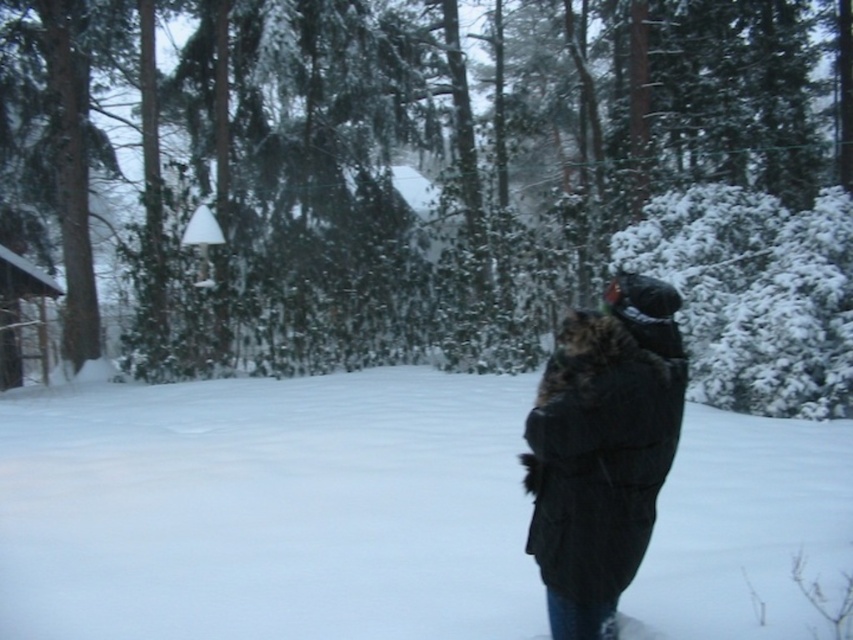
You are standing in the winter scene and want to take a photo of the dark fur coat at center and the wooden cabin at left. Which object should you focus on first if you want to capture both in the same frame without moving the camera?

The dark fur coat at center is located below the wooden cabin at left, so you should focus on the wooden cabin at left first as it is higher in the frame, allowing both objects to be captured in the same shot without moving the camera.